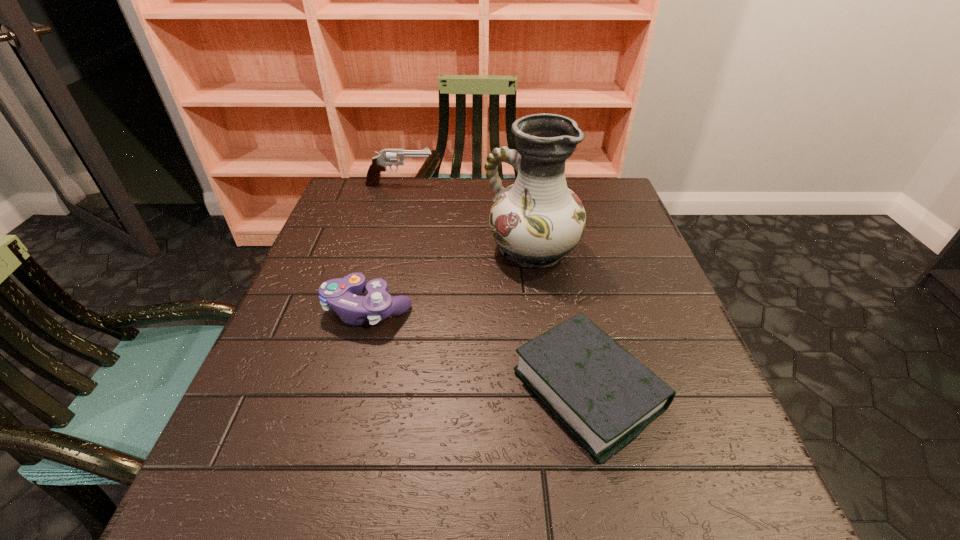
Locate an element on the screen. Image resolution: width=960 pixels, height=540 pixels. object that is at the far edge is located at coordinates (387, 157).

Image resolution: width=960 pixels, height=540 pixels. Identify the location of gun positioned at the left edge. (387, 157).

What are the coordinates of `control positioned at the left edge` in the screenshot? It's located at (342, 294).

Where is `vase present at the right edge`? vase present at the right edge is located at coordinates (537, 220).

Locate an element on the screen. The height and width of the screenshot is (540, 960). Bible positioned at the right edge is located at coordinates (606, 397).

At what (x,y) coordinates should I click in order to perform the action: click on object that is positioned at the far left corner. Please return your answer as a coordinate pair (x, y). This screenshot has height=540, width=960. Looking at the image, I should click on (387, 157).

The height and width of the screenshot is (540, 960). Find the location of `vacant space at the far edge`. vacant space at the far edge is located at coordinates (439, 213).

Find the location of a particular element. vacant area at the near edge of the desktop is located at coordinates (590, 475).

Where is `free space at the left edge of the desktop`? Image resolution: width=960 pixels, height=540 pixels. free space at the left edge of the desktop is located at coordinates (366, 258).

Image resolution: width=960 pixels, height=540 pixels. In order to click on vacant space at the right edge of the desktop in this screenshot , I will do `click(613, 292)`.